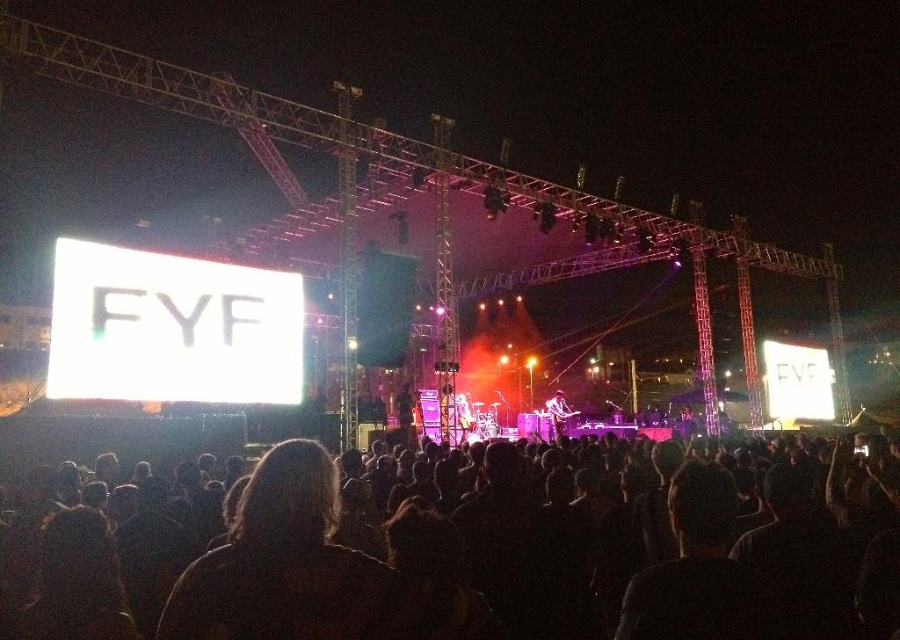
You are standing at the point with coordinates point (484, 554) in the concert scene. What do you see directly in front of you?

You see the black matte crowd at center directly in front of you.

You are a stagehand responsible for ensuring safety during the concert. You notice the black matte crowd at center and the black fabric at center. Given that the safety protocol requires a minimum distance of 30 meters between the crowd and any flammable materials, is the current setup compliant?

The distance between the black matte crowd at center and the black fabric at center is 32.77 meters, which exceeds the required 30 meters. Therefore, the setup is compliant with safety protocols.

You are a photographer trying to capture the entire stage and the crowd. Given that your camera can only focus on objects within a 10m width, can you fit both the black matte crowd at center and the shiny silver guitar at center in the frame?

The black matte crowd at center is wider than the shiny silver guitar at center. Since the camera can focus on objects within a 10m width, and the crowd is wider, it might be possible to include both if their combined width doesn